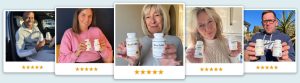
The width and height of the screenshot is (300, 83). Find the location of `pill bottle`. pill bottle is located at coordinates (260, 45), (278, 49), (233, 45), (201, 50), (155, 52), (133, 47), (96, 46), (87, 45), (41, 36), (47, 36).